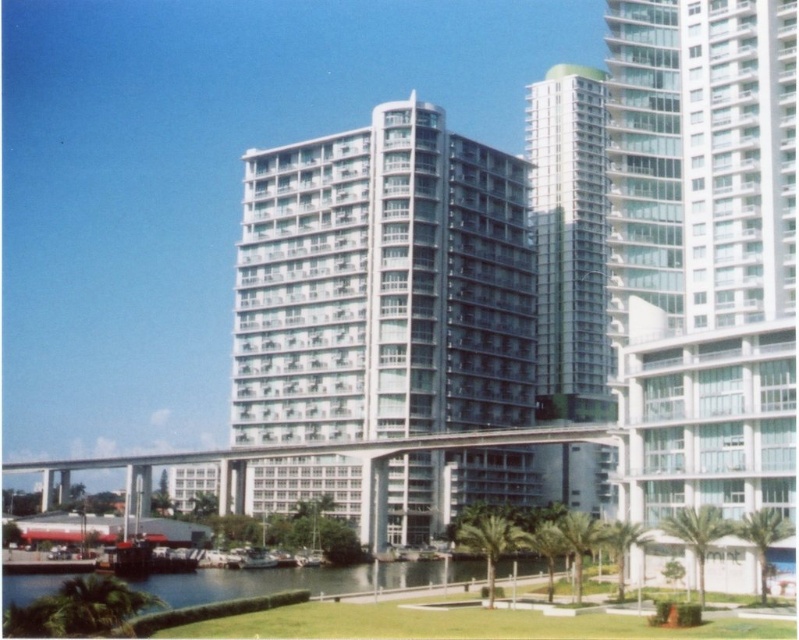
Question: Considering the relative positions of white glass building at center and green grass at lower center in the image provided, where is white glass building at center located with respect to green grass at lower center?

Choices:
 (A) above
 (B) below

Answer: (A)

Question: Which point is closer to the camera taking this photo?

Choices:
 (A) (466, 193)
 (B) (566, 253)
 (C) (28, 595)

Answer: (C)

Question: Does white glassy building at center have a lesser width compared to green grass at lower center?

Choices:
 (A) yes
 (B) no

Answer: (A)

Question: Which object appears farthest from the camera in this image?

Choices:
 (A) white glassy building at center
 (B) clear glass building at right
 (C) white glass building at center

Answer: (A)

Question: Is white glassy building at center to the right of metallic silver boat at center from the viewer's perspective?

Choices:
 (A) no
 (B) yes

Answer: (B)

Question: Which point is closer to the camera taking this photo?

Choices:
 (A) (629, 36)
 (B) (590, 147)
 (C) (249, 554)
 (D) (265, 502)

Answer: (A)